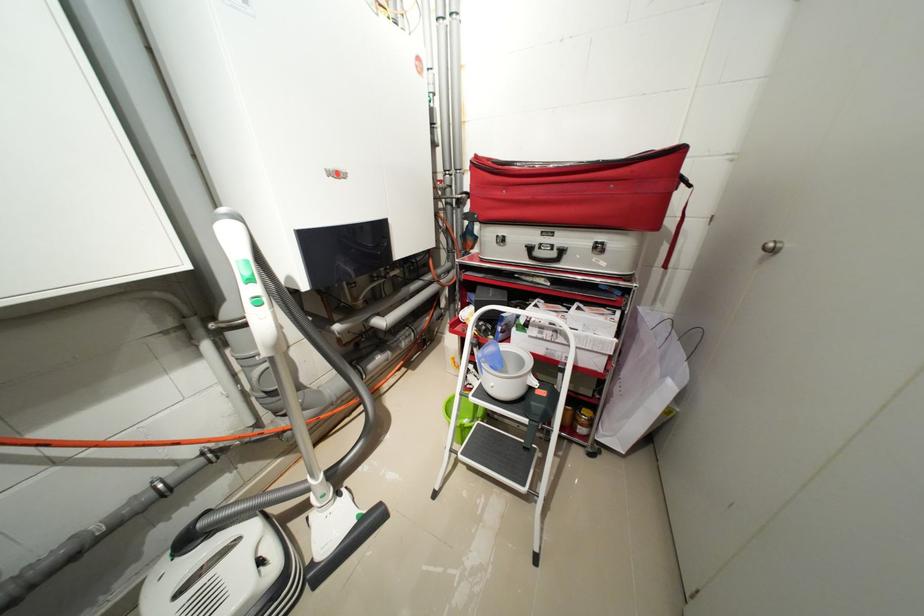
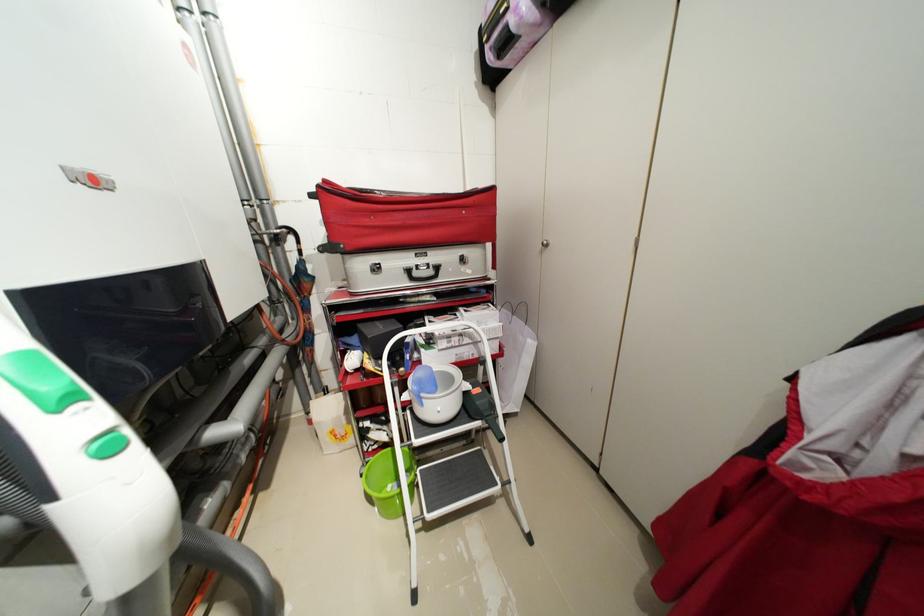
The point at [543,254] is marked in the first image. Where is the corresponding point in the second image?

(422, 275)